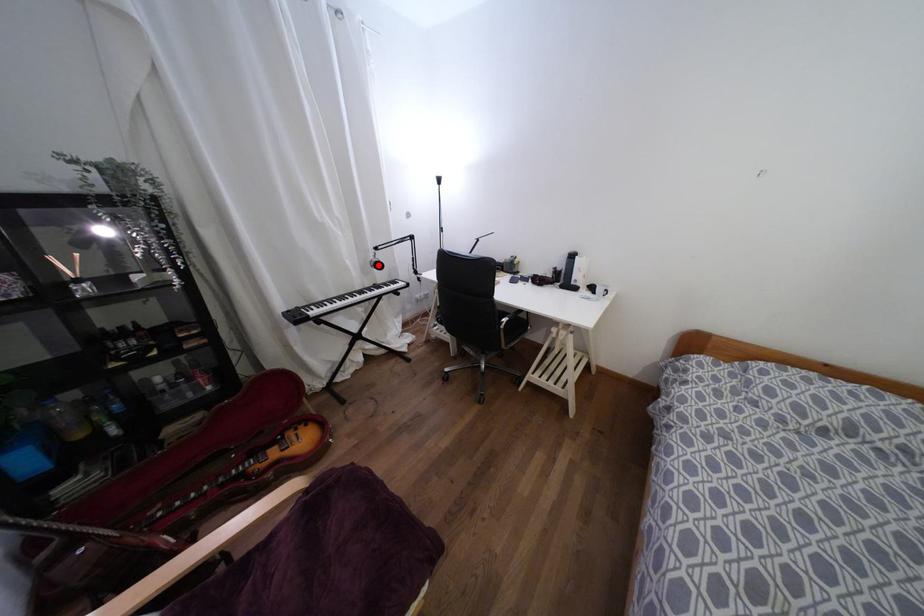
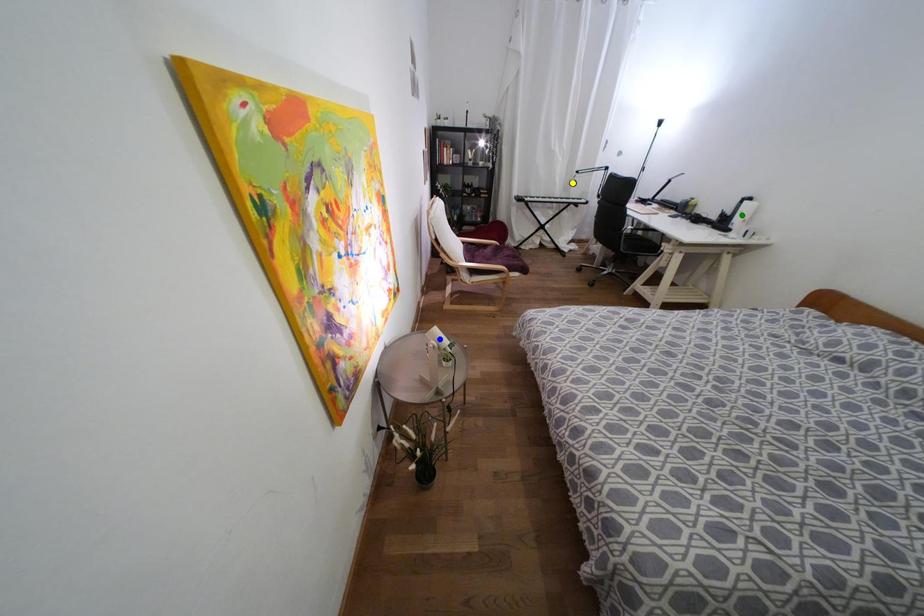
Question: I am providing you with two images of the same scene from different viewpoints. A red point is marked on the first image. You are given multiple points on the second image. Which point in image 2 represents the same 3d spot as the red point in image 1?

Choices:
 (A) green point
 (B) blue point
 (C) yellow point

Answer: (C)